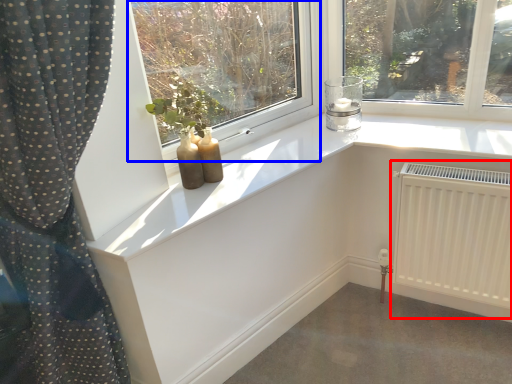
Question: Which object appears closest to the camera in this image, radiator (highlighted by a red box) or window (highlighted by a blue box)?

Choices:
 (A) radiator
 (B) window

Answer: (B)